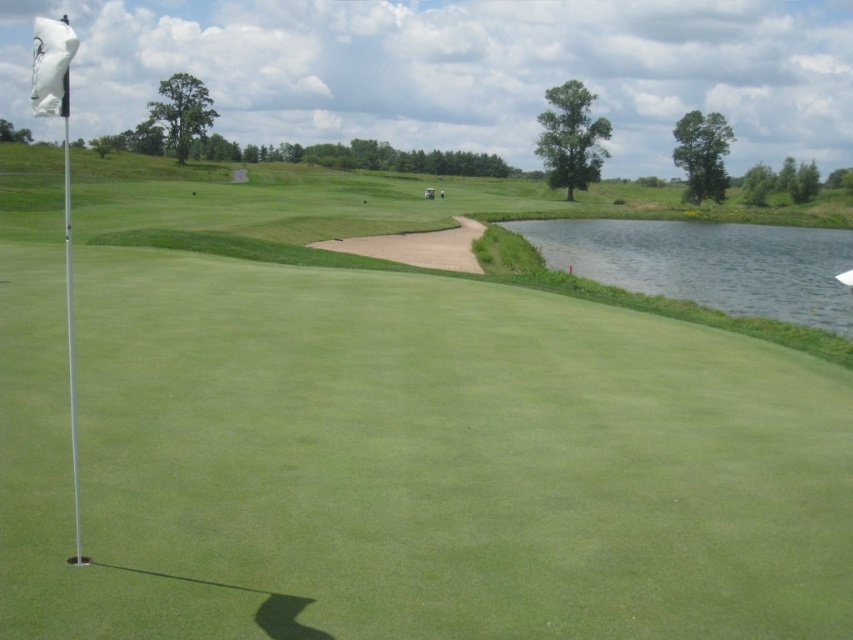
Based on the photo, is clear water at right positioned in front of white matte flag at upper left?

That is False.

Can you confirm if clear water at right is shorter than white matte flag at upper left?

Yes, clear water at right is shorter than white matte flag at upper left.

What do you see at coordinates (708, 262) in the screenshot? This screenshot has width=853, height=640. I see `clear water at right` at bounding box center [708, 262].

Identify the location of clear water at right. This screenshot has height=640, width=853. (708, 262).